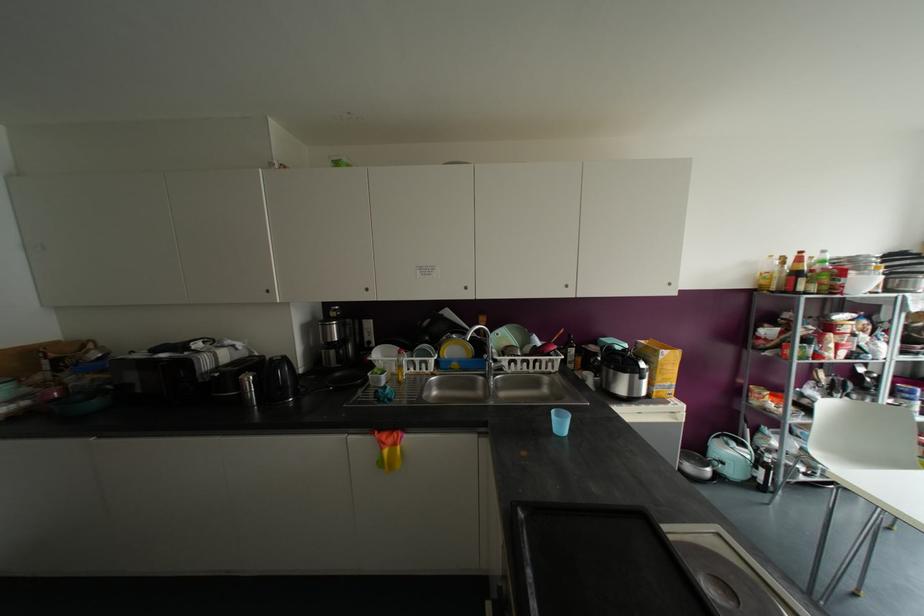
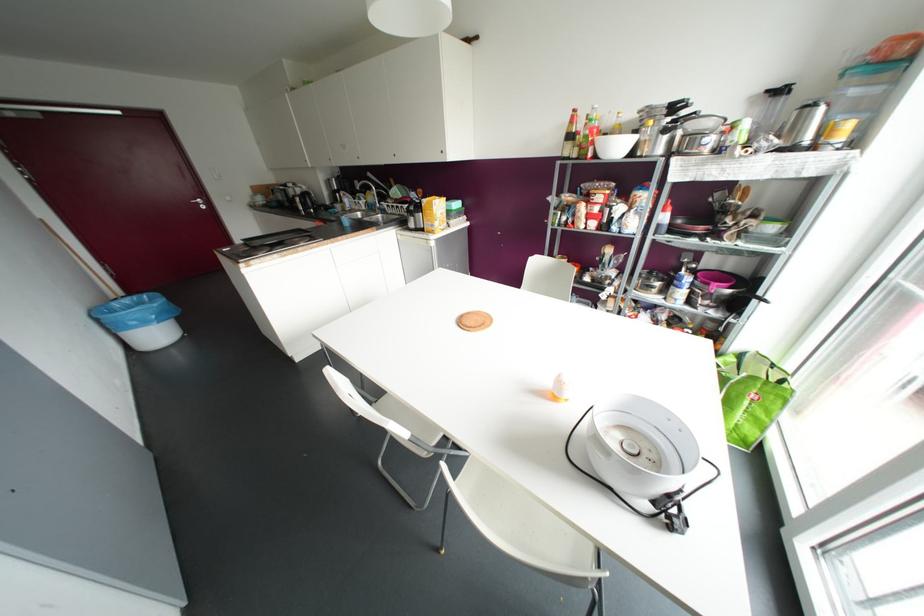
In the second image, find the point that corresponds to point 800,252 in the first image.

(574, 110)